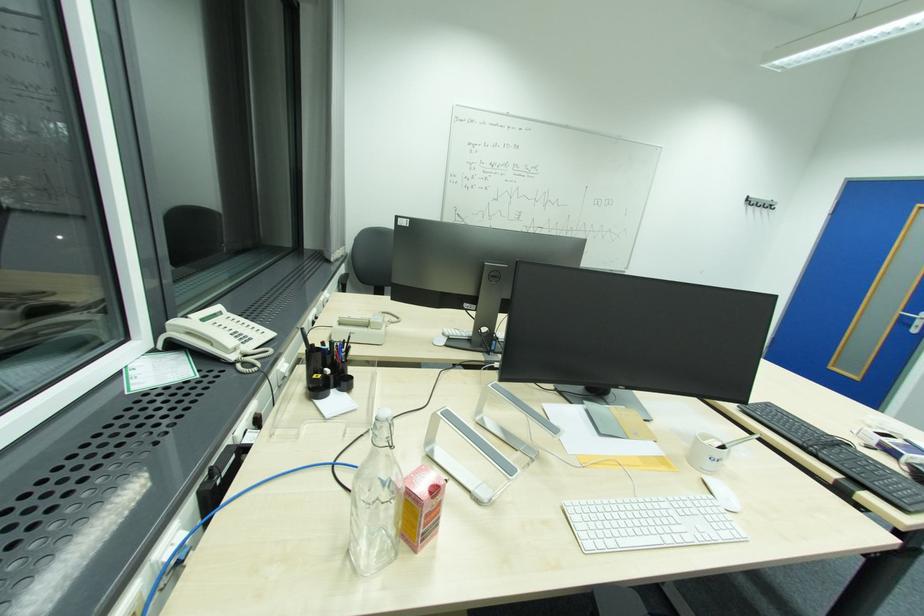
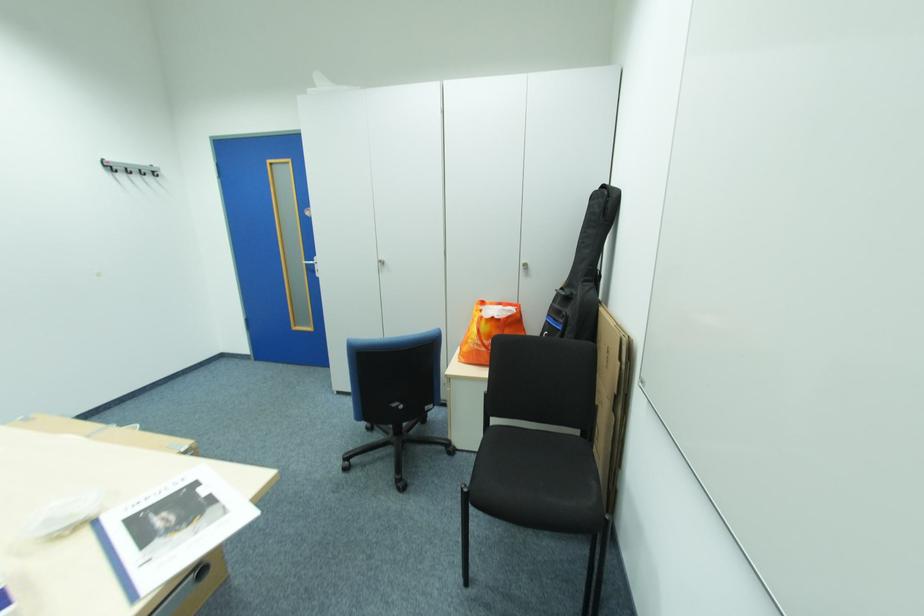
Where in the second image is the point corresponding to (755,204) from the first image?

(114, 171)